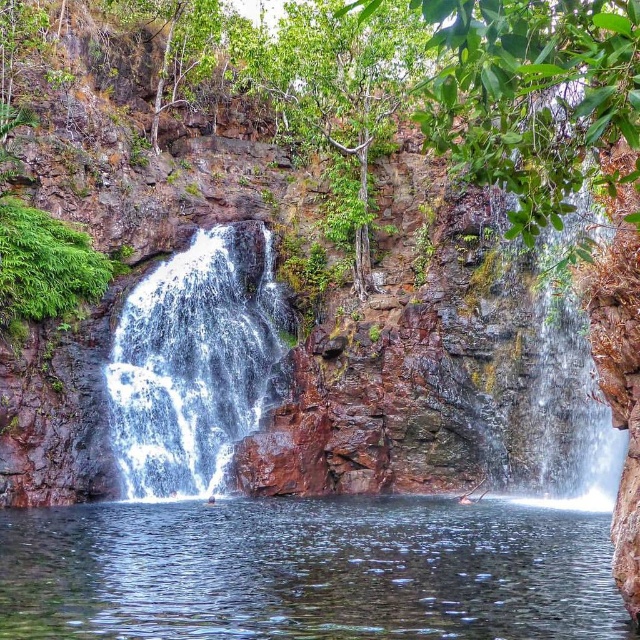
You are standing at the base of the waterfall and want to take a photo of the point at coordinates point (234, 508). Your camera has a maximum focus range of 70 meters. Will you be able to focus on that point?

The distance of point (234, 508) from viewer is 72.06 meters, which exceeds the camera maximum focus range of 70 meters. Therefore, the camera cannot focus on that point.

From the picture: You are standing at the edge of the pool and want to cross to the other side. There are two paths available. One leads through the clear water at center, and the other through the white frothy water at center left. Which path has calmer water for easier crossing?

The clear water at center has calmer water for easier crossing because it is positioned to the right of the white frothy water at center left, which is likely more turbulent due to the waterfall streams.